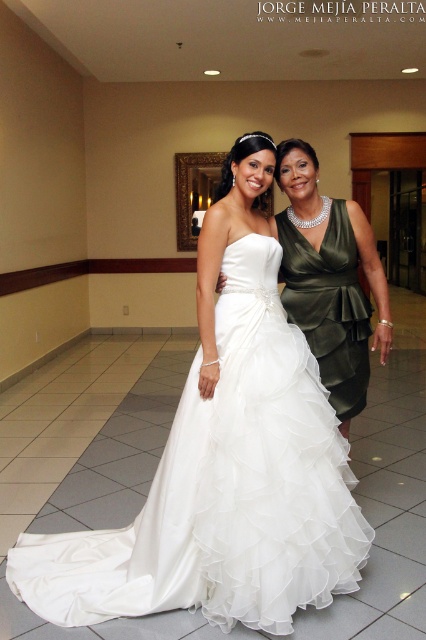
Is white satin dress at center positioned before satin green dress at right?

That is True.

Measure the distance between white satin dress at center and satin green dress at right.

white satin dress at center is 56.38 centimeters away from satin green dress at right.

Who is more distant from viewer, (282, 506) or (351, 246)?

The point (351, 246) is more distant.

Where is `white satin dress at center`? white satin dress at center is located at coordinates (224, 461).